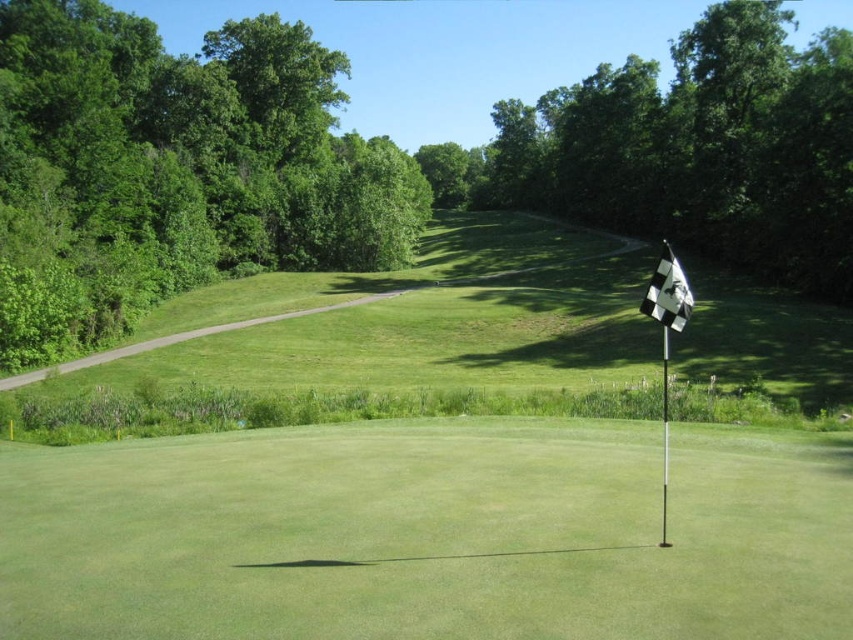
Does green leafy tree at center lie behind black checkered flag at right?

Yes, green leafy tree at center is further from the viewer.

Can you confirm if green leafy tree at center is smaller than black checkered flag at right?

Incorrect, green leafy tree at center is not smaller in size than black checkered flag at right.

What are the coordinates of `green leafy tree at center` in the screenshot? It's located at (689, 148).

Is green leafy trees at upper left to the right of black checkered flag at right from the viewer's perspective?

In fact, green leafy trees at upper left is to the left of black checkered flag at right.

Is green leafy trees at upper left further to the viewer compared to black checkered flag at right?

That is True.

Identify the location of green leafy trees at upper left. (173, 170).

At what (x,y) coordinates should I click in order to perform the action: click on white checkered flag at center. Please return your answer as a coordinate pair (x, y). Looking at the image, I should click on (428, 534).

Can you confirm if white checkered flag at center is taller than black checkered flag at right?

Incorrect, white checkered flag at center's height is not larger of black checkered flag at right's.

The image size is (853, 640). What do you see at coordinates (428, 534) in the screenshot? I see `white checkered flag at center` at bounding box center [428, 534].

Image resolution: width=853 pixels, height=640 pixels. I want to click on white checkered flag at center, so click(x=428, y=534).